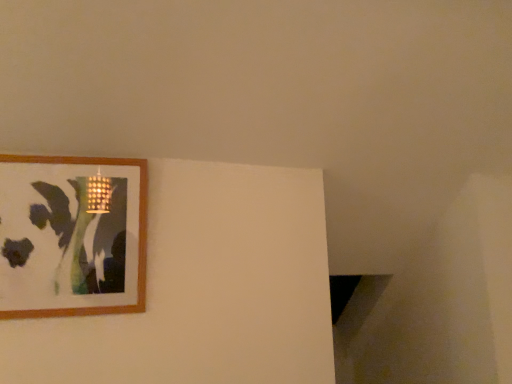
Find the location of a particular element. The height and width of the screenshot is (384, 512). wooden picture frame at upper left is located at coordinates (138, 237).

What do you see at coordinates (138, 237) in the screenshot?
I see `wooden picture frame at upper left` at bounding box center [138, 237].

The width and height of the screenshot is (512, 384). What are the coordinates of `wooden picture frame at upper left` in the screenshot? It's located at (138, 237).